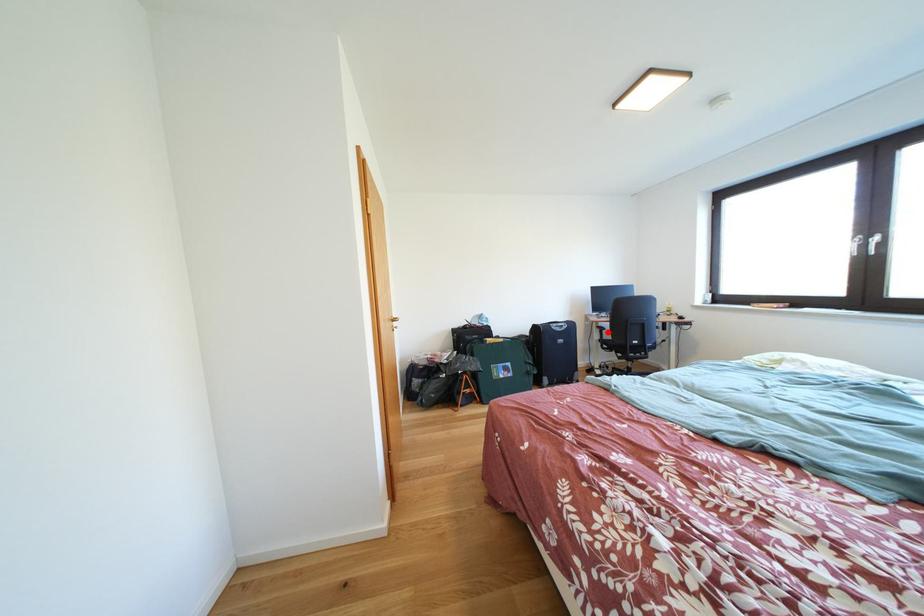
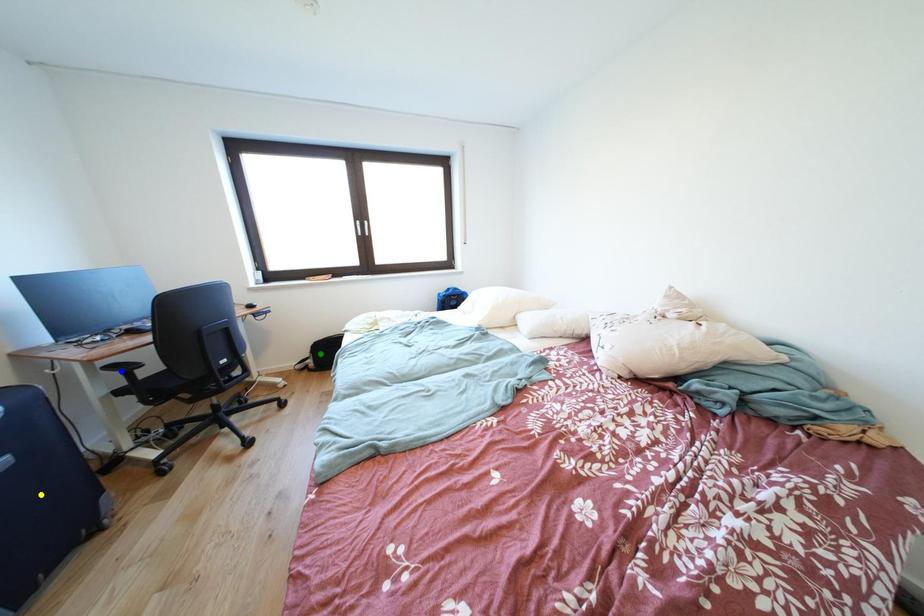
Question: I am providing you with two images of the same scene from different viewpoints. A red point is marked on the first image. You are given multiple points on the second image. In image 2, which mark is for the same physical point as the one in image 1?

Choices:
 (A) green point
 (B) yellow point
 (C) blue point

Answer: (C)